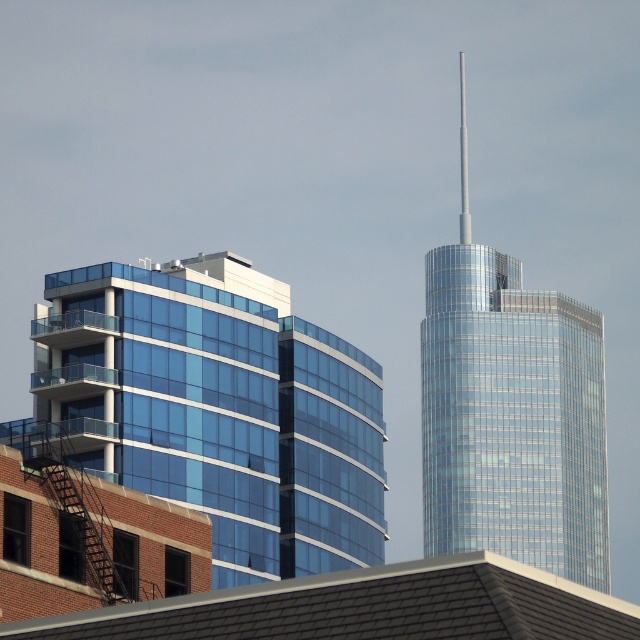
Question: Does transparent glass building at left appear over shiny glass tower at right?

Choices:
 (A) no
 (B) yes

Answer: (A)

Question: Among these points, which one is farthest from the camera?

Choices:
 (A) [422, 412]
 (B) [227, 352]

Answer: (A)

Question: Is transparent glass building at left closer to the viewer compared to shiny glass tower at right?

Choices:
 (A) yes
 (B) no

Answer: (A)

Question: Is transparent glass building at left bigger than shiny glass tower at right?

Choices:
 (A) no
 (B) yes

Answer: (A)